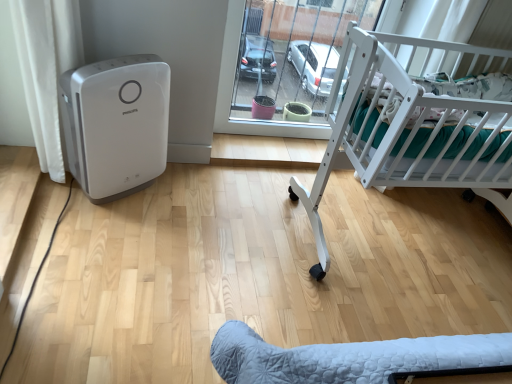
Question: In terms of height, does transparent glass door at center look taller or shorter compared to white plastic air purifier at left?

Choices:
 (A) tall
 (B) short

Answer: (A)

Question: Considering their positions, is transparent glass door at center located in front of or behind white plastic air purifier at left?

Choices:
 (A) front
 (B) behind

Answer: (B)

Question: Estimate the real-world distances between objects in this image. Which object is closer to the white plastic air purifier at left?

Choices:
 (A) transparent glass door at center
 (B) white matte crib at right

Answer: (A)

Question: Estimate the real-world distances between objects in this image. Which object is closer to the white plastic air purifier at left?

Choices:
 (A) transparent glass door at center
 (B) white matte crib at right

Answer: (A)